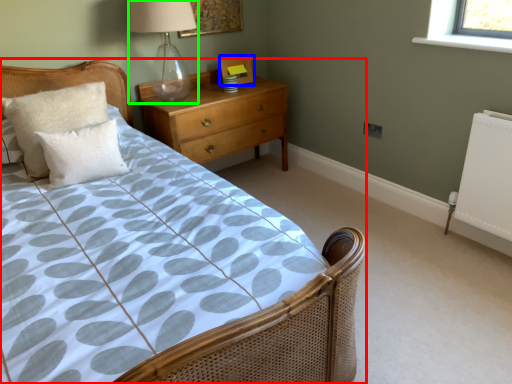
Question: Considering the real-world distances, which object is farthest from bed (highlighted by a red box)? picture frame (highlighted by a blue box) or table lamp (highlighted by a green box)?

Choices:
 (A) picture frame
 (B) table lamp

Answer: (B)